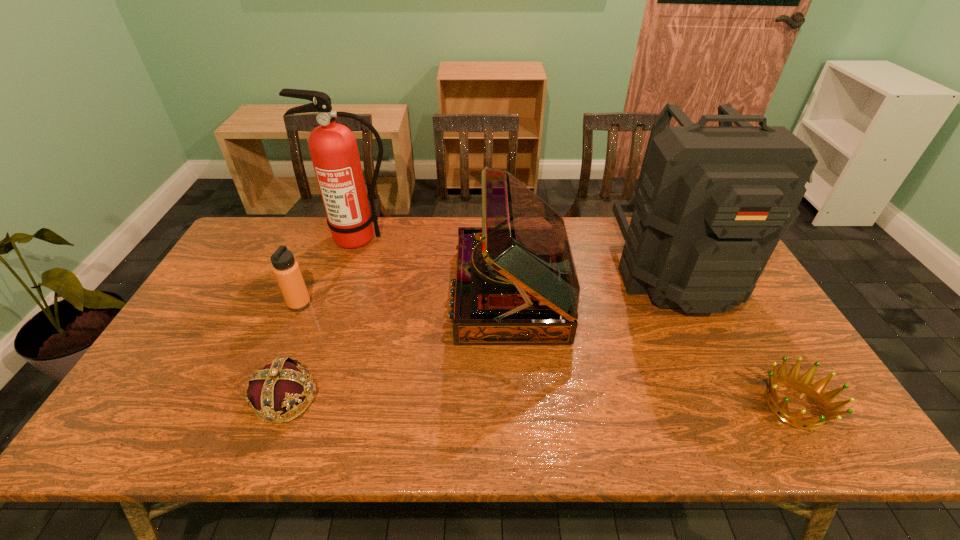
The height and width of the screenshot is (540, 960). I want to click on vacant area between the backpack and the record player, so [x=593, y=283].

I want to click on unoccupied position between the backpack and the right crown, so click(735, 340).

Identify the location of free point between the thermos bottle and the shortest object. The width and height of the screenshot is (960, 540). pyautogui.click(x=547, y=355).

Image resolution: width=960 pixels, height=540 pixels. Find the location of `free space between the shortest object and the backpack`. free space between the shortest object and the backpack is located at coordinates (735, 340).

Find the location of `unoccupied position between the left crown and the fire extinguisher`. unoccupied position between the left crown and the fire extinguisher is located at coordinates (323, 319).

Identify which object is the fifth nearest to the left crown. Please provide its 2D coordinates. Your answer should be formatted as a tuple, i.e. [(x, y)], where the tuple contains the x and y coordinates of a point satisfying the conditions above.

[(815, 392)]

Select which object appears as the second closest to the fourth object from left to right. Please provide its 2D coordinates. Your answer should be formatted as a tuple, i.e. [(x, y)], where the tuple contains the x and y coordinates of a point satisfying the conditions above.

[(333, 148)]

Image resolution: width=960 pixels, height=540 pixels. Identify the location of free space in the image that satisfies the following two spatial constraints: 1. on the front-facing side of the shortest object; 2. on the left side of the fourth object from left to right. (518, 406).

Where is `vacant space that satisfies the following two spatial constraints: 1. on the front-facing side of the fourth object from left to right; 2. on the back side of the shorter crown`? The image size is (960, 540). vacant space that satisfies the following two spatial constraints: 1. on the front-facing side of the fourth object from left to right; 2. on the back side of the shorter crown is located at coordinates (518, 406).

Identify the location of vacant space that satisfies the following two spatial constraints: 1. on the handle side of the fire extinguisher; 2. on the right side of the shortest object. (302, 406).